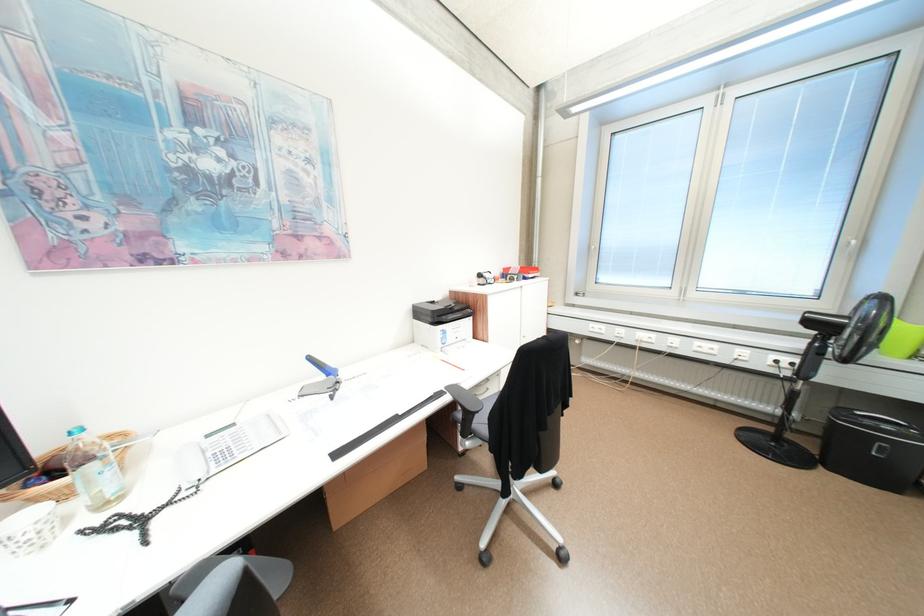
This screenshot has width=924, height=616. Find the location of `printer lid`. printer lid is located at coordinates (435, 310).